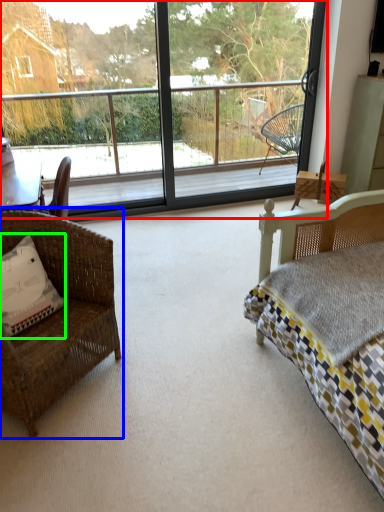
Question: Considering the real-world distances, which object is closest to window (highlighted by a red box)? chair (highlighted by a blue box) or pillow (highlighted by a green box).

Choices:
 (A) chair
 (B) pillow

Answer: (A)